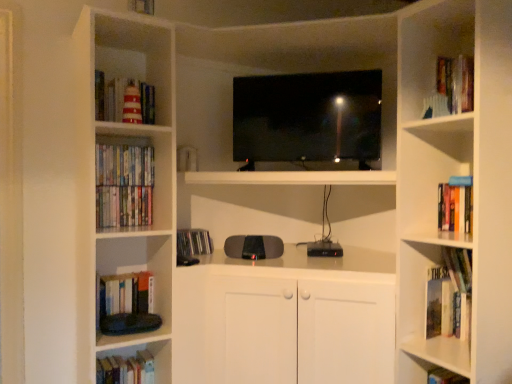
What are the coordinates of `empty space that is ontop of hardcover books at left, which is counted as the third book, starting from the top (from a real-world perspective)` in the screenshot? It's located at (119, 190).